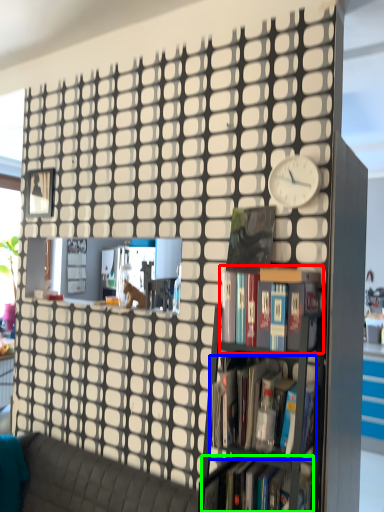
Question: Estimate the real-world distances between objects in this image. Which object is farther from book (highlighted by a red box), book (highlighted by a blue box) or book (highlighted by a green box)?

Choices:
 (A) book
 (B) book

Answer: (B)